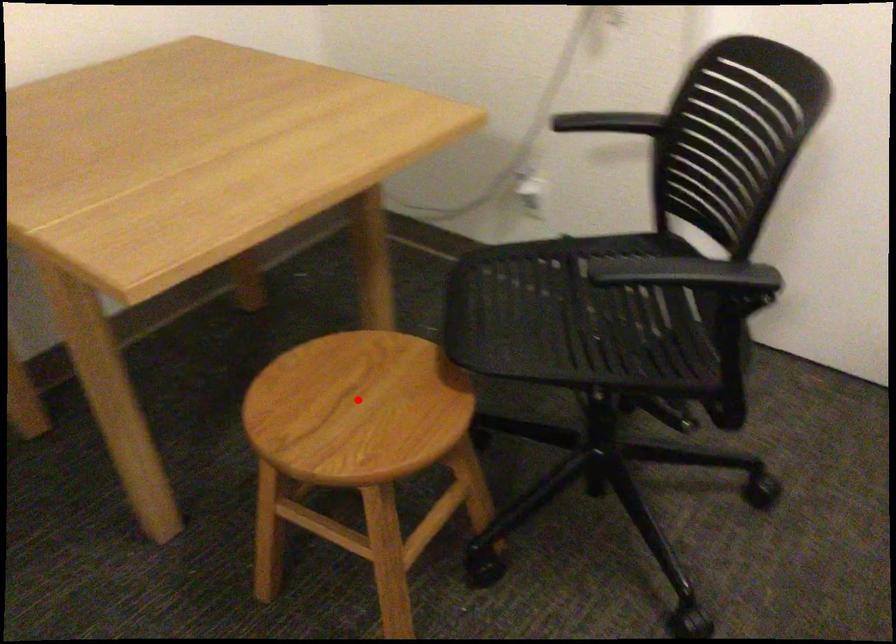
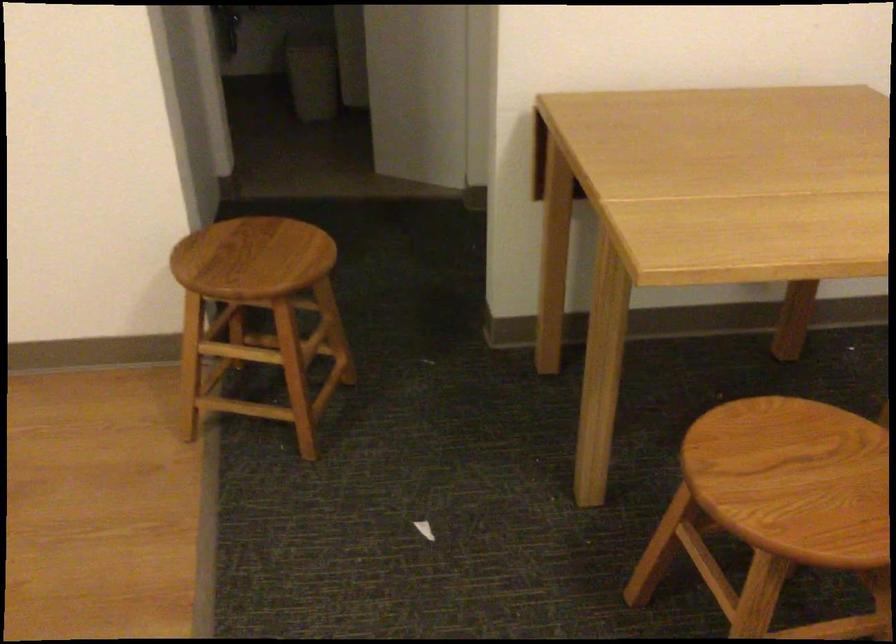
In the second image, find the point that corresponds to the highlighted location in the first image.

(807, 476)